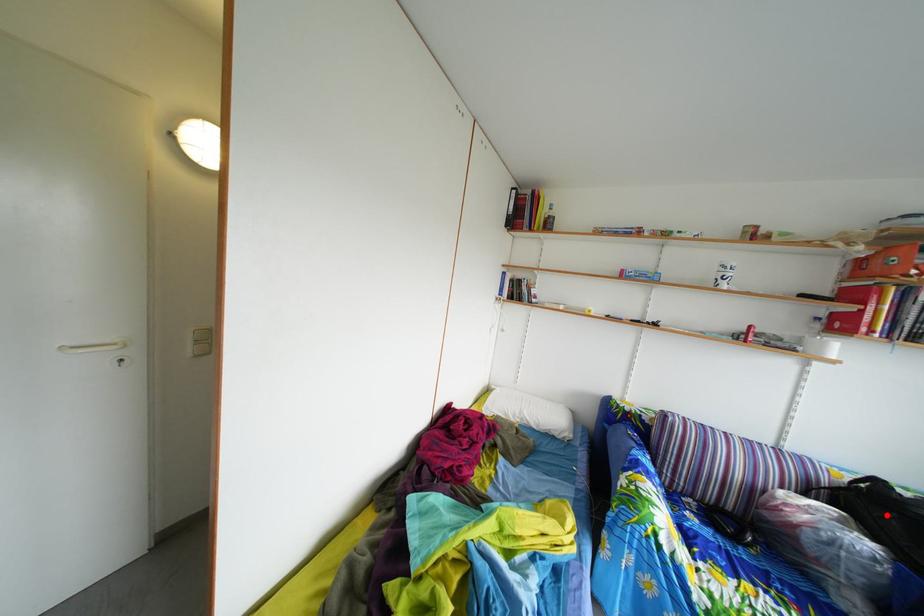
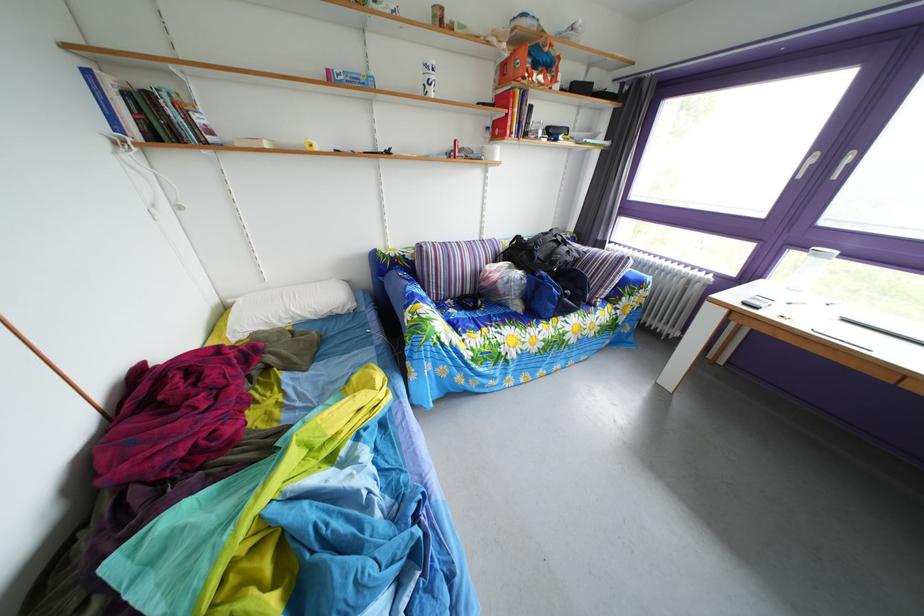
Find the pixel in the second image that matches the highlighted location in the first image.

(529, 261)